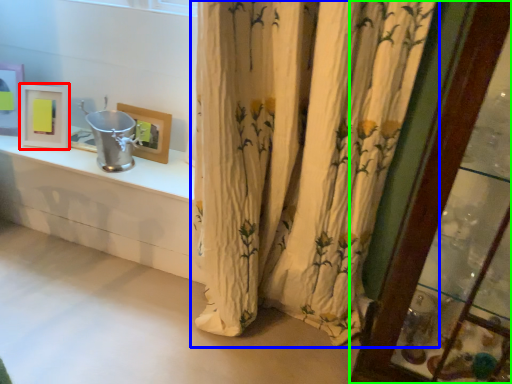
Question: Which object is positioned closest to picture frame (highlighted by a red box)? Select from curtain (highlighted by a blue box) and glass door (highlighted by a green box).

Choices:
 (A) curtain
 (B) glass door

Answer: (A)